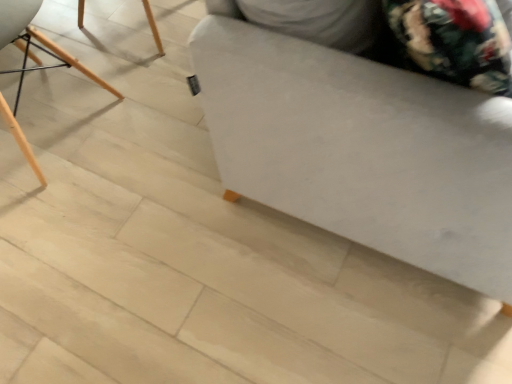
This screenshot has width=512, height=384. I want to click on free location in front of wooden chair at left, so click(x=88, y=257).